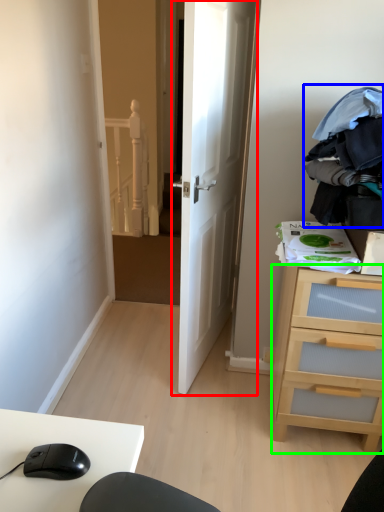
Question: Considering the real-world distances, which object is closest to door (highlighted by a red box)? clothing (highlighted by a blue box) or chest of drawers (highlighted by a green box).

Choices:
 (A) clothing
 (B) chest of drawers

Answer: (A)